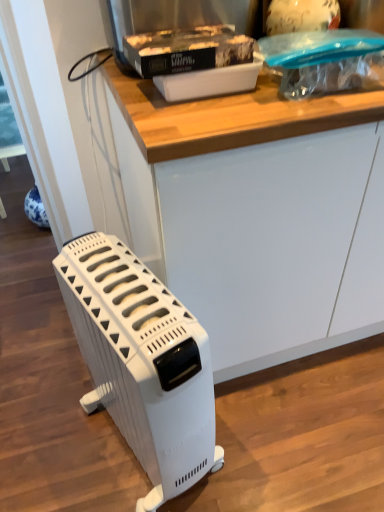
Question: Could you tell me if white plastic heater at lower left is turned towards white matte counter at center?

Choices:
 (A) no
 (B) yes

Answer: (A)

Question: Is white plastic heater at lower left positioned with its back to white matte counter at center?

Choices:
 (A) no
 (B) yes

Answer: (A)

Question: Is white plastic heater at lower left shorter than white matte counter at center?

Choices:
 (A) no
 (B) yes

Answer: (B)

Question: Can you confirm if white plastic heater at lower left is smaller than white matte counter at center?

Choices:
 (A) no
 (B) yes

Answer: (B)

Question: Is the depth of white plastic heater at lower left greater than that of white matte counter at center?

Choices:
 (A) yes
 (B) no

Answer: (B)

Question: From the image's perspective, is white plastic heater at lower left under white matte counter at center?

Choices:
 (A) no
 (B) yes

Answer: (B)

Question: From a real-world perspective, does white matte counter at center stand above white plastic container at upper center?

Choices:
 (A) yes
 (B) no

Answer: (B)

Question: Can you confirm if white matte counter at center is smaller than white plastic container at upper center?

Choices:
 (A) no
 (B) yes

Answer: (A)

Question: Can you confirm if white matte counter at center is thinner than white plastic container at upper center?

Choices:
 (A) no
 (B) yes

Answer: (A)

Question: Does white matte counter at center have a greater width compared to white plastic container at upper center?

Choices:
 (A) yes
 (B) no

Answer: (A)

Question: Can you confirm if white matte counter at center is positioned to the right of white plastic container at upper center?

Choices:
 (A) yes
 (B) no

Answer: (A)

Question: Is white matte counter at center positioned behind white plastic container at upper center?

Choices:
 (A) yes
 (B) no

Answer: (B)

Question: Is white plastic container at upper center not inside white matte counter at center?

Choices:
 (A) yes
 (B) no

Answer: (A)